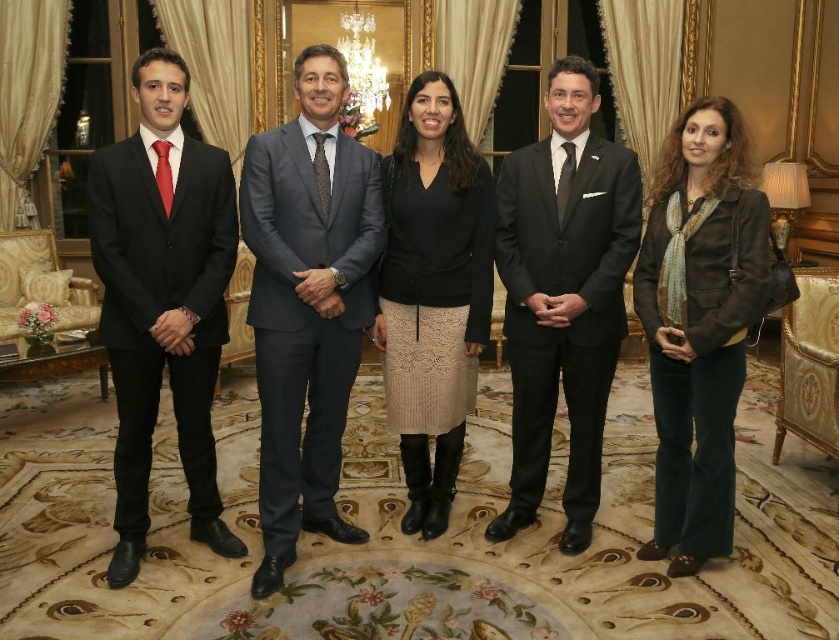
You are an event organizer arranging seating for a group photo. You need to seat the gray suit at center and the black lace skirt at center in chairs. The chairs are standard size. Which person might need a larger chair to accommodate their size?

The gray suit at center has a larger size compared to the black lace skirt at center, so the gray suit at center would need a larger chair.

Based on the scene description, where is the gray suit at center located in terms of coordinates?

The gray suit at center is located at point coordinates of 0.475 on the x axis and 0.367 on the y axis.

Consider the image. You are organizing a charity event and need to arrange seating based on the guests clothing colors. The venue has two tables, one for black attire and one for brown. Which table should the person in the matte black suit at left and the velvet brown jacket at center sit at?

The person in the matte black suit at left should sit at the black attire table, while the person in the velvet brown jacket at center should sit at the brown table.